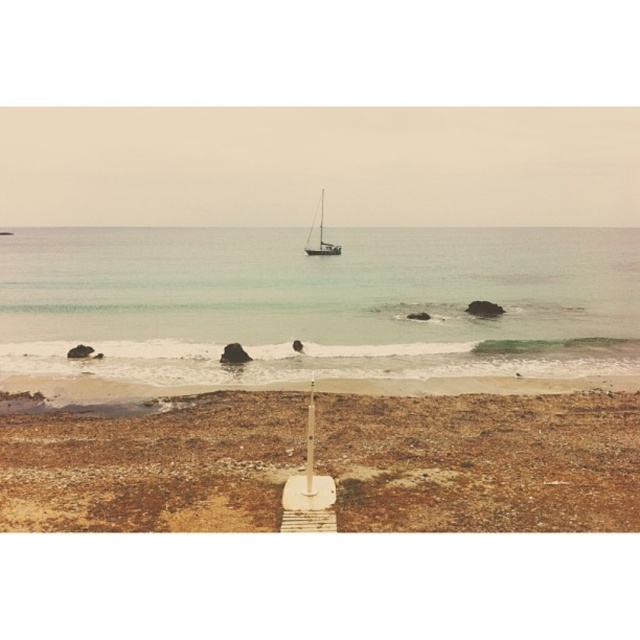
Question: Which point is farther to the camera?

Choices:
 (A) clear water at center
 (B) brown sandy beach at lower left

Answer: (A)

Question: Among these objects, which one is nearest to the camera?

Choices:
 (A) brown sandy beach at lower left
 (B) clear water at center

Answer: (A)

Question: Does clear water at center appear on the right side of brown sandy beach at lower left?

Choices:
 (A) no
 (B) yes

Answer: (A)

Question: Is clear water at center thinner than brown sandy beach at lower left?

Choices:
 (A) no
 (B) yes

Answer: (A)

Question: Can you confirm if clear water at center is thinner than brown sandy beach at lower left?

Choices:
 (A) yes
 (B) no

Answer: (B)

Question: Which of the following is the closest to the observer?

Choices:
 (A) (624, 294)
 (B) (406, 445)

Answer: (B)